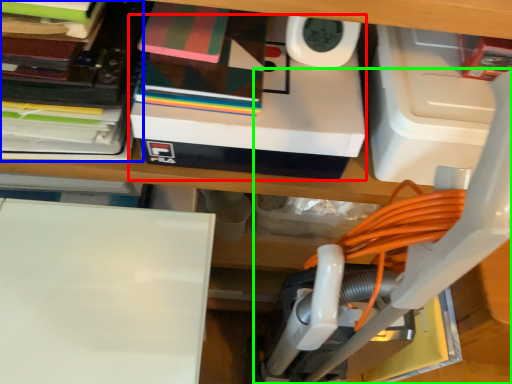
Question: Based on their relative distances, which object is nearer to box (highlighted by a red box)? Choose from book (highlighted by a blue box) and vacuum (highlighted by a green box).

Choices:
 (A) book
 (B) vacuum

Answer: (A)